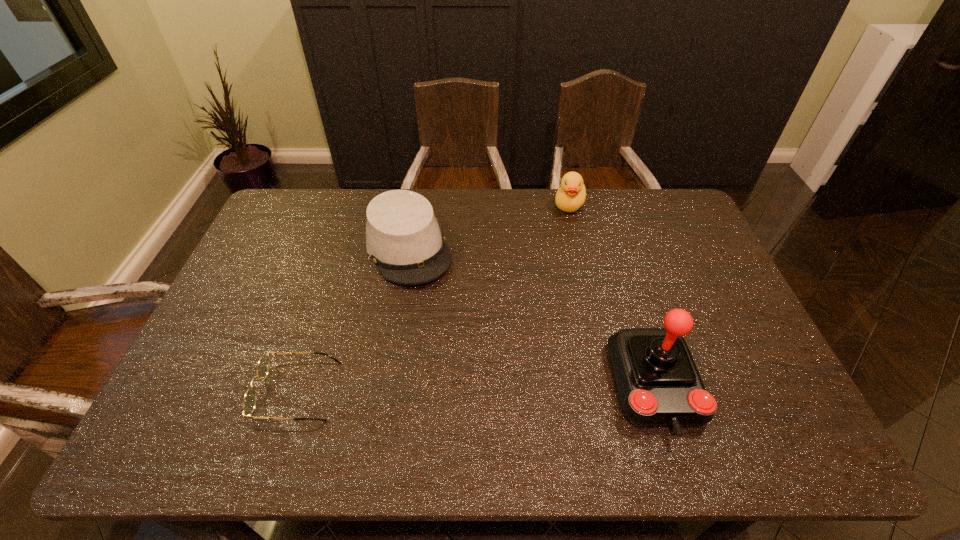
The width and height of the screenshot is (960, 540). What are the coordinates of `empty space that is in between the hat and the joystick` in the screenshot? It's located at (532, 318).

Locate an element on the screen. free area in between the tallest object and the hat is located at coordinates (532, 318).

At what (x,y) coordinates should I click in order to perform the action: click on free space between the shortest object and the tallest object. Please return your answer as a coordinate pair (x, y). The width and height of the screenshot is (960, 540). Looking at the image, I should click on (476, 389).

Point out which object is positioned as the nearest to the duck. Please provide its 2D coordinates. Your answer should be formatted as a tuple, i.e. [(x, y)], where the tuple contains the x and y coordinates of a point satisfying the conditions above.

[(403, 238)]

Select which object is the second closest to the joystick. Please provide its 2D coordinates. Your answer should be formatted as a tuple, i.e. [(x, y)], where the tuple contains the x and y coordinates of a point satisfying the conditions above.

[(571, 195)]